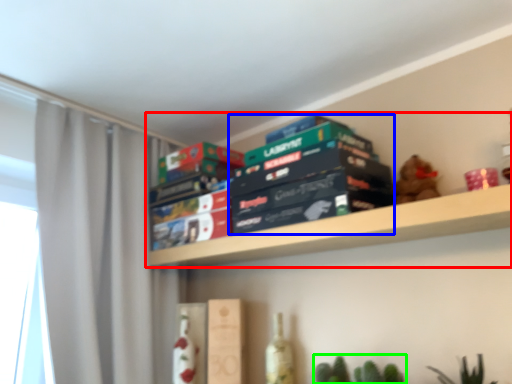
Question: Which object is positioned farthest from shelf (highlighted by a red box)? Select from book (highlighted by a blue box) and plant (highlighted by a green box).

Choices:
 (A) book
 (B) plant

Answer: (B)